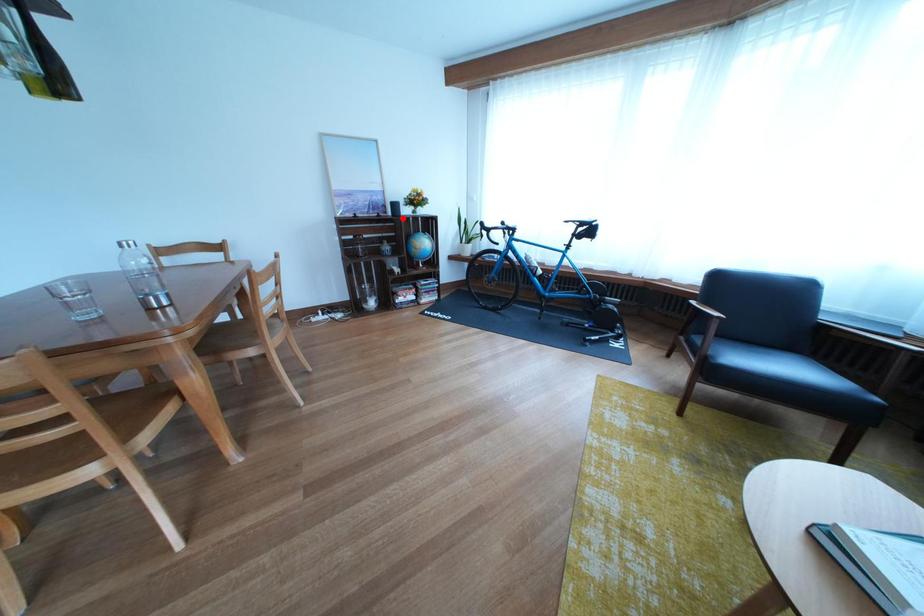
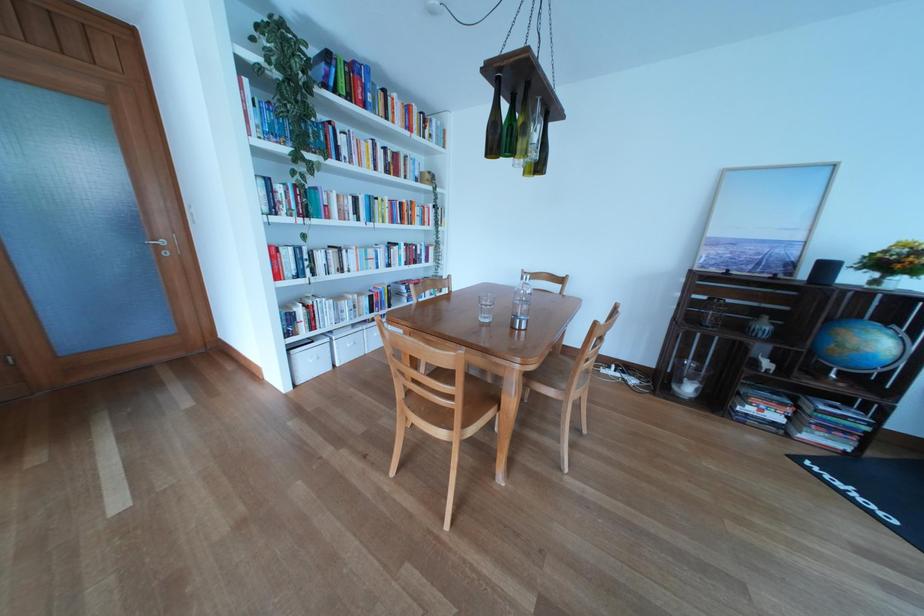
Question: I am providing you with two images of the same scene from different viewpoints. A red point is shown in image1. For the corresponding object point in image2, is it positioned nearer or farther from the camera?

Choices:
 (A) Nearer
 (B) Farther

Answer: (B)